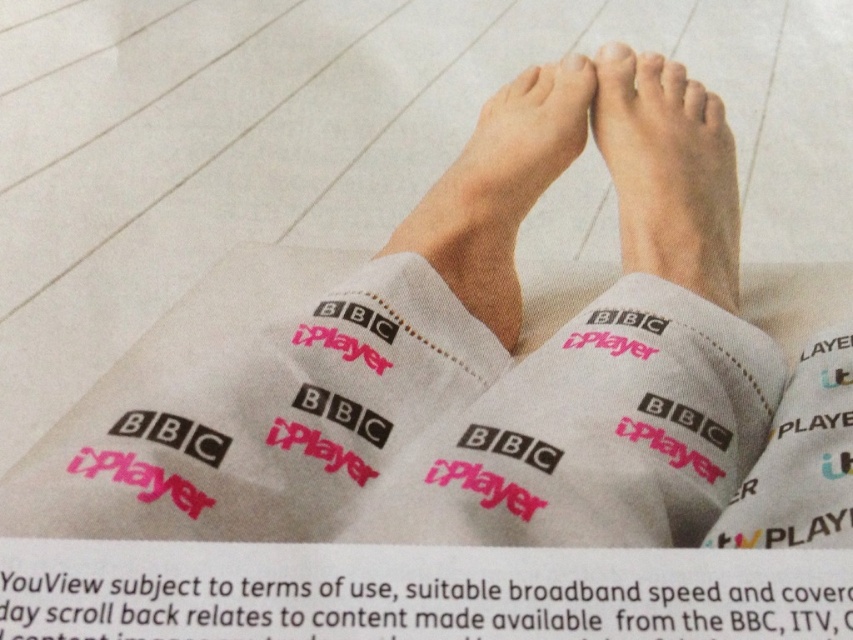
Question: Is pink matte toe at center wider than white matte toe at center?

Choices:
 (A) yes
 (B) no

Answer: (A)

Question: Which object is closer to the camera taking this photo?

Choices:
 (A) white cotton socks at center
 (B) white matte toe at center
 (C) pink matte toe at center
 (D) matte skin toe at upper center

Answer: (A)

Question: Does skinny white leg at center appear over matte skin toe at upper center?

Choices:
 (A) yes
 (B) no

Answer: (B)

Question: Observing the image, what is the correct spatial positioning of black paper text at lower center in reference to matte skin toe at upper center?

Choices:
 (A) above
 (B) below

Answer: (B)

Question: Which object appears farthest from the camera in this image?

Choices:
 (A) skinny white leg at center
 (B) matte skin toe at upper center
 (C) white cotton socks at center

Answer: (B)

Question: Estimate the real-world distances between objects in this image. Which object is farther from the white cotton socks at center?

Choices:
 (A) black paper text at lower center
 (B) white matte toe at center

Answer: (B)